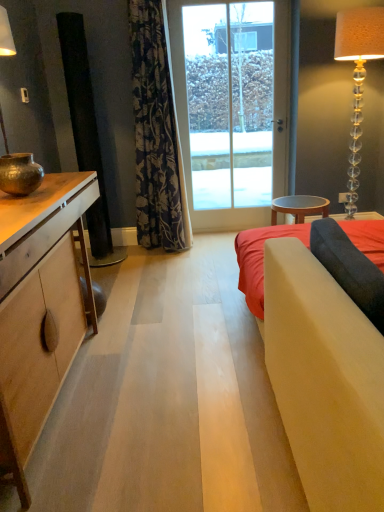
Find the location of a particular element. The width and height of the screenshot is (384, 512). velvet gray pillow at right is located at coordinates (349, 268).

At what (x,y) coordinates should I click in order to perform the action: click on dark floral fabric curtain at center. Please return your answer as a coordinate pair (x, y). Looking at the image, I should click on (156, 134).

Image resolution: width=384 pixels, height=512 pixels. What do you see at coordinates (156, 134) in the screenshot? I see `dark floral fabric curtain at center` at bounding box center [156, 134].

The width and height of the screenshot is (384, 512). Find the location of `clear glass floor lamp at right`. clear glass floor lamp at right is located at coordinates (358, 77).

This screenshot has height=512, width=384. What do you see at coordinates (299, 207) in the screenshot?
I see `wooden stool at center` at bounding box center [299, 207].

Image resolution: width=384 pixels, height=512 pixels. What are the coordinates of `velvet gray pillow at right` in the screenshot? It's located at [349, 268].

From the image's perspective, is wooden stool at center above or below clear glass floor lamp at right?

From the image's perspective, wooden stool at center appears below clear glass floor lamp at right.

Is wooden stool at center far from clear glass floor lamp at right?

No, wooden stool at center is not far away from clear glass floor lamp at right.

Image resolution: width=384 pixels, height=512 pixels. I want to click on lamp above the wooden stool at center (from a real-world perspective), so click(358, 77).

Considering the relative positions of wooden stool at center and clear glass floor lamp at right in the image provided, is wooden stool at center to the left or to the right of clear glass floor lamp at right?

In the image, wooden stool at center appears on the left side of clear glass floor lamp at right.

Is velvet gray pillow at right next to matte wood cabinet at left and touching it?

No, velvet gray pillow at right is not next to matte wood cabinet at left.

Can you confirm if velvet gray pillow at right is bigger than matte wood cabinet at left?

Incorrect, velvet gray pillow at right is not larger than matte wood cabinet at left.

From the image's perspective, is velvet gray pillow at right on top of matte wood cabinet at left?

Yes, from the image's perspective, velvet gray pillow at right is over matte wood cabinet at left.

In the image, is transparent glass door at center on the left side or the right side of velvet gray pillow at right?

In the image, transparent glass door at center appears on the left side of velvet gray pillow at right.

Looking at this image, is transparent glass door at center outside of velvet gray pillow at right?

Yes.

From the picture: How many degrees apart are the facing directions of transparent glass door at center and velvet gray pillow at right?

They differ by 90.2 degrees in their facing directions.

Is matte wood cabinet at left not close to transparent glass door at center?

That's right, there is a large distance between matte wood cabinet at left and transparent glass door at center.

Is point (11, 234) closer to viewer compared to point (178, 98)?

Yes.

Does matte wood cabinet at left turn towards transparent glass door at center?

No, matte wood cabinet at left is not facing towards transparent glass door at center.

From a real-world perspective, which object rests below the other?

From a 3D spatial view, matte wood cabinet at left is below.

From a real-world perspective, which object rests below the other?

From a 3D spatial view, wooden stool at center is below.

Is dark floral fabric curtain at center oriented towards wooden stool at center?

No, dark floral fabric curtain at center is not aimed at wooden stool at center.

Are dark floral fabric curtain at center and wooden stool at center located far from each other?

Indeed, dark floral fabric curtain at center is not near wooden stool at center.

Which object is wider, dark floral fabric curtain at center or transparent glass door at center?

dark floral fabric curtain at center.

Between point (146, 13) and point (279, 23), which one is positioned behind?

Point (279, 23)

Could transparent glass door at center be considered to be inside dark floral fabric curtain at center?

Actually, transparent glass door at center is outside dark floral fabric curtain at center.

Which object is closer to the camera taking this photo, velvet gray pillow at right or transparent glass door at center?

velvet gray pillow at right is more forward.

Is velvet gray pillow at right to the right of transparent glass door at center from the viewer's perspective?

Yes, velvet gray pillow at right is to the right of transparent glass door at center.

Would you say velvet gray pillow at right contains transparent glass door at center?

Definitely not — transparent glass door at center is not inside velvet gray pillow at right.

Considering the relative sizes of velvet gray pillow at right and transparent glass door at center in the image provided, is velvet gray pillow at right shorter than transparent glass door at center?

Indeed, velvet gray pillow at right has a lesser height compared to transparent glass door at center.

The width and height of the screenshot is (384, 512). In order to click on lamp in front of the wooden stool at center in this screenshot , I will do pyautogui.click(x=358, y=77).

At what (x,y) coordinates should I click in order to perform the action: click on cabinetry below the velvet gray pillow at right (from the image's perspective). Please return your answer as a coordinate pair (x, y). Image resolution: width=384 pixels, height=512 pixels. Looking at the image, I should click on click(x=43, y=230).

Looking at the image, which one is located further to transparent glass door at center, matte wood cabinet at left or wooden stool at center?

matte wood cabinet at left is further to transparent glass door at center.

In the scene shown: Based on their spatial positions, is transparent glass door at center or clear glass floor lamp at right closer to wooden stool at center?

The object closer to wooden stool at center is clear glass floor lamp at right.

Looking at the image, which one is located closer to transparent glass door at center, velvet gray pillow at right or matte wood cabinet at left?

matte wood cabinet at left is closer to transparent glass door at center.

Estimate the real-world distances between objects in this image. Which object is further from velvet gray pillow at right, transparent glass door at center or dark floral fabric curtain at center?

transparent glass door at center.

Estimate the real-world distances between objects in this image. Which object is closer to wooden stool at center, matte wood cabinet at left or dark floral fabric curtain at center?

dark floral fabric curtain at center lies closer to wooden stool at center than the other object.

Considering their positions, is velvet gray pillow at right positioned closer to dark floral fabric curtain at center than matte wood cabinet at left?

Among the two, matte wood cabinet at left is located nearer to dark floral fabric curtain at center.

Estimate the real-world distances between objects in this image. Which object is closer to wooden stool at center, dark floral fabric curtain at center or transparent glass door at center?

transparent glass door at center.

From the picture: Estimate the real-world distances between objects in this image. Which object is further from transparent glass door at center, matte wood cabinet at left or dark floral fabric curtain at center?

Based on the image, matte wood cabinet at left appears to be further to transparent glass door at center.

Where is `lamp between velvet gray pillow at right and wooden stool at center along the z-axis`? This screenshot has height=512, width=384. lamp between velvet gray pillow at right and wooden stool at center along the z-axis is located at coordinates (358, 77).

You are a GUI agent. You are given a task and a screenshot of the screen. Output one action in this format:
    pyautogui.click(x=<x>, y=<y>)
    Task: Click on the pillow between matte wood cabinet at left and dark floral fabric curtain at center along the z-axis
    The image size is (384, 512).
    Given the screenshot: What is the action you would take?
    pyautogui.click(x=349, y=268)

You are a GUI agent. You are given a task and a screenshot of the screen. Output one action in this format:
    pyautogui.click(x=<x>, y=<y>)
    Task: Click on the pillow between matte wood cabinet at left and clear glass floor lamp at right
    The height and width of the screenshot is (512, 384).
    Given the screenshot: What is the action you would take?
    pyautogui.click(x=349, y=268)

Find the location of a particular element. pillow between matte wood cabinet at left and wooden stool at center along the z-axis is located at coordinates (349, 268).